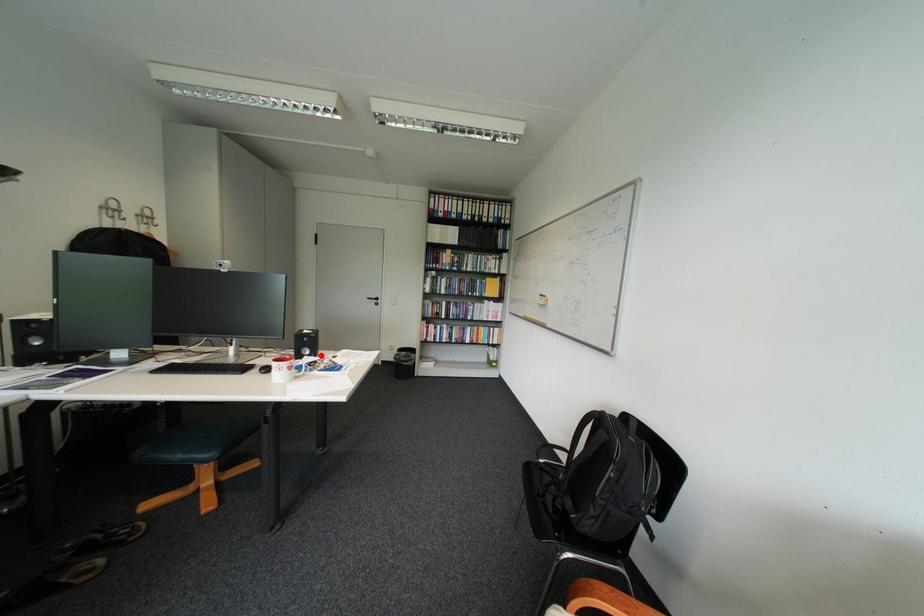
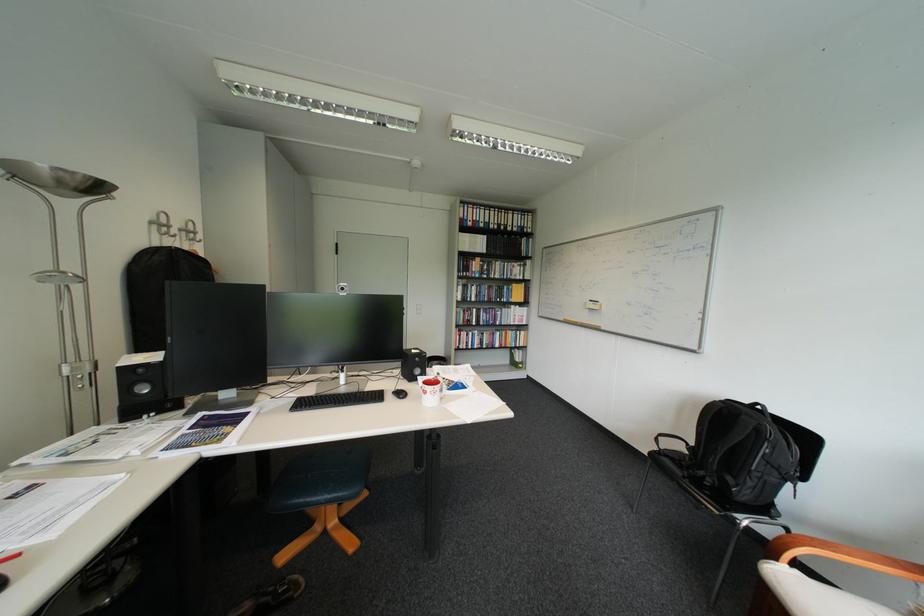
The point at the highlighted location is marked in the first image. Where is the corresponding point in the second image?

(432, 376)